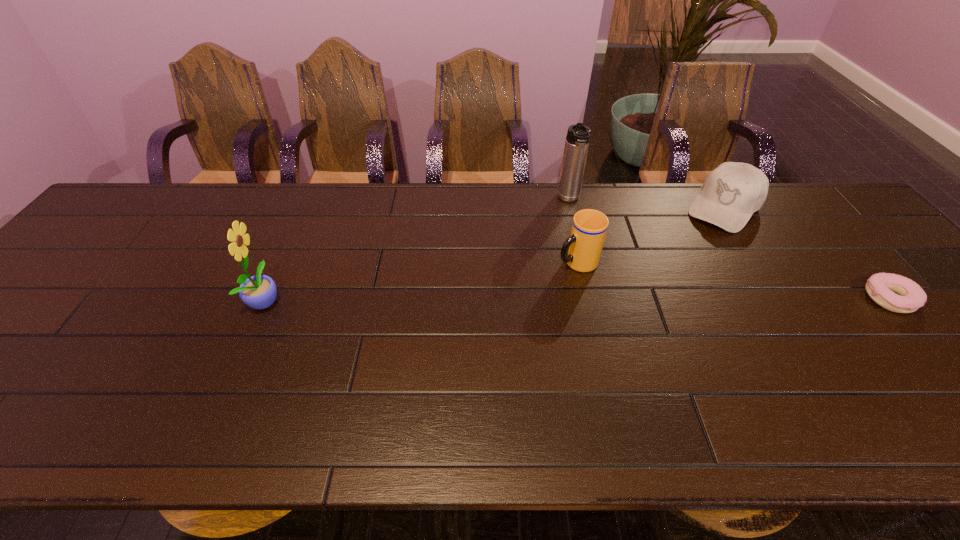
Locate an element on the screen. The width and height of the screenshot is (960, 540). the leftmost object is located at coordinates pyautogui.click(x=259, y=292).

Identify the location of doughnut. This screenshot has width=960, height=540. (909, 296).

Identify the location of the rightmost object. The image size is (960, 540). (909, 296).

The width and height of the screenshot is (960, 540). Find the location of `cup`. cup is located at coordinates (582, 250).

Identify the location of baseball cap. This screenshot has width=960, height=540. (731, 193).

You are a GUI agent. You are given a task and a screenshot of the screen. Output one action in this format:
    pyautogui.click(x=<x>, y=<y>)
    Task: Click on the thermos bottle
    This screenshot has width=960, height=540.
    Given the screenshot: What is the action you would take?
    pyautogui.click(x=578, y=136)

What are the coordinates of `vacant space situated on the front-facing side of the sunflower` in the screenshot? It's located at (428, 300).

At what (x,y) coordinates should I click in order to perform the action: click on vacant space located on the front of the rightmost object. Please return your answer as a coordinate pair (x, y). The image size is (960, 540). Looking at the image, I should click on (958, 379).

The image size is (960, 540). I want to click on free space located on the side of the third nearest object with the handle, so click(506, 292).

I want to click on vacant space located on the side of the third nearest object with the handle, so click(509, 291).